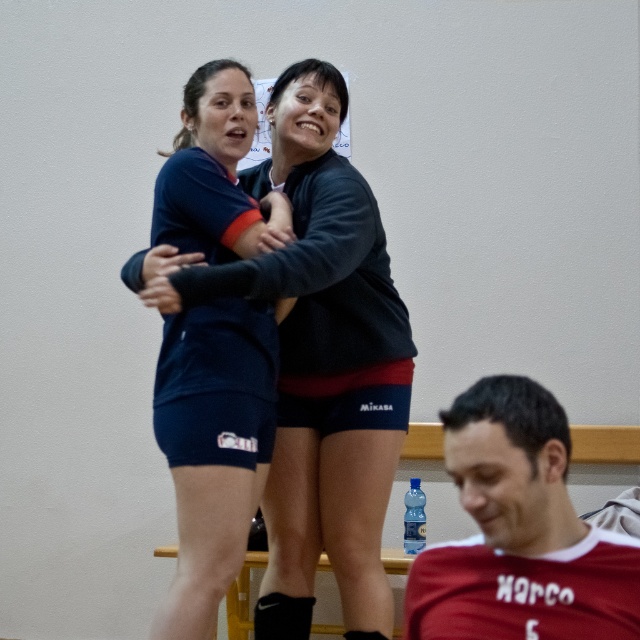
Question: Is dark blue jersey at center below red jersey at lower right?

Choices:
 (A) no
 (B) yes

Answer: (A)

Question: In this image, where is dark blue jersey at center located relative to red jersey at lower right?

Choices:
 (A) above
 (B) below

Answer: (A)

Question: Which point appears closest to the camera in this image?

Choices:
 (A) (467, 403)
 (B) (401, 426)

Answer: (A)

Question: Can you confirm if dark blue jersey at center is positioned to the left of red jersey at lower right?

Choices:
 (A) no
 (B) yes

Answer: (B)

Question: Which point is closer to the camera?

Choices:
 (A) red jersey at lower right
 (B) dark blue jersey at center

Answer: (A)